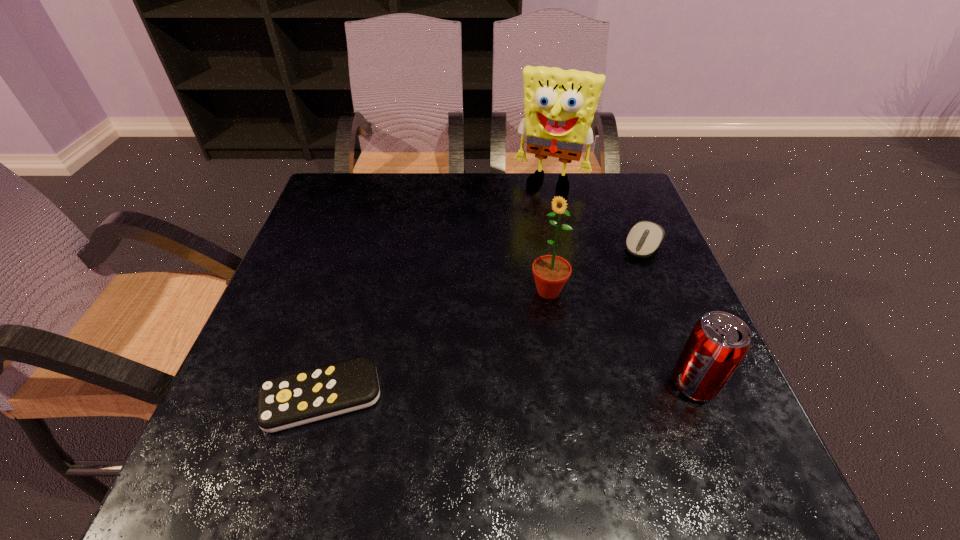
The image size is (960, 540). What are the coordinates of `vacant space on the desktop that is between the leftmost object and the third tallest object and is positioned on the face of the fourth shortest object` in the screenshot? It's located at (459, 392).

Where is `free space on the desktop that is between the shortest object and the soda can and is positioned on the wheel side of the fourth nearest object`? The image size is (960, 540). free space on the desktop that is between the shortest object and the soda can and is positioned on the wheel side of the fourth nearest object is located at coordinates (552, 389).

What are the coordinates of `free space on the desktop that is between the shortest object and the third shortest object and is positioned on the face of the tallest object` in the screenshot? It's located at (463, 392).